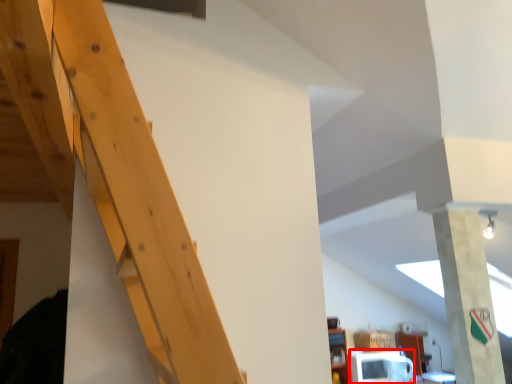
Question: From the image's perspective, what is the correct spatial relationship of microwave (annotated by the red box) in relation to pillar?

Choices:
 (A) above
 (B) below

Answer: (B)